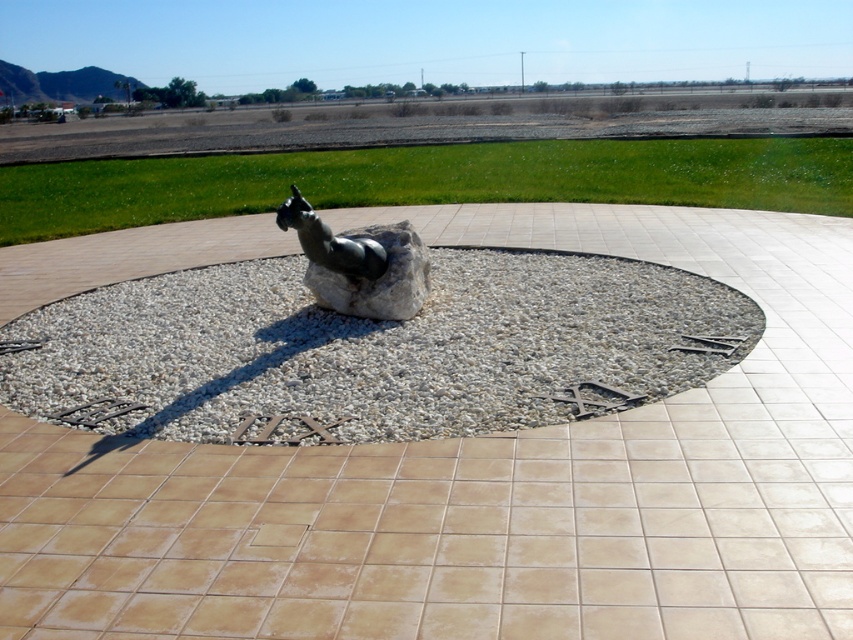
Question: Considering the relative positions of white gravel at center and bronze statue at center in the image provided, where is white gravel at center located with respect to bronze statue at center?

Choices:
 (A) above
 (B) below

Answer: (B)

Question: Estimate the real-world distances between objects in this image. Which object is farther from the bronze statue at center?

Choices:
 (A) polished bronze horse at center
 (B) sandy beige stone at center

Answer: (B)

Question: Which object appears farthest from the camera in this image?

Choices:
 (A) white gravel at center
 (B) sandy beige stone at center
 (C) bronze statue at center
 (D) polished bronze horse at center

Answer: (C)

Question: Considering the relative positions of sandy beige stone at center and polished bronze horse at center in the image provided, where is sandy beige stone at center located with respect to polished bronze horse at center?

Choices:
 (A) above
 (B) below

Answer: (B)

Question: Is white gravel at center further to the viewer compared to bronze statue at center?

Choices:
 (A) yes
 (B) no

Answer: (B)

Question: Which object appears farthest from the camera in this image?

Choices:
 (A) bronze statue at center
 (B) white gravel at center
 (C) polished bronze horse at center

Answer: (A)